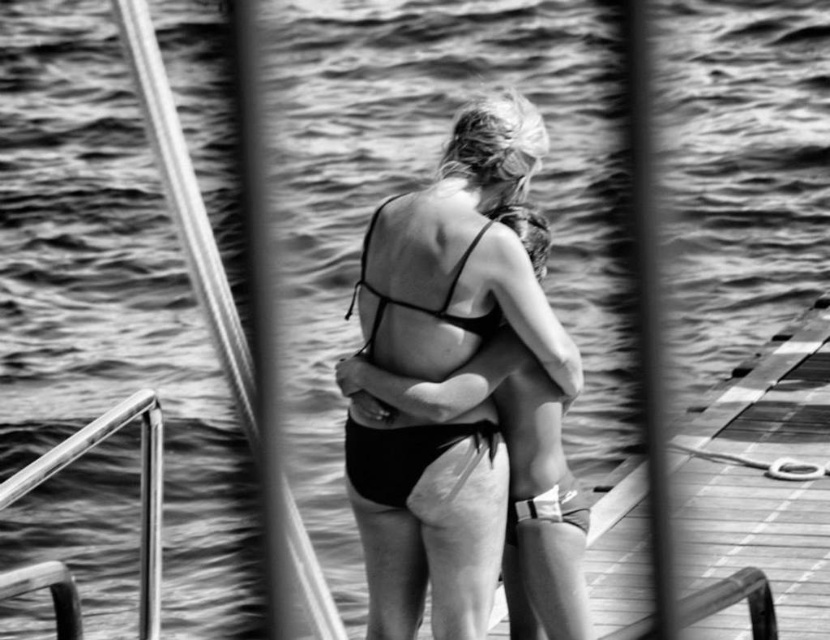
Question: Observing the image, what is the correct spatial positioning of polished metal rail at left in reference to black matte bikini top at center?

Choices:
 (A) right
 (B) left

Answer: (B)

Question: Which object is positioned farthest from the black matte swimsuit at center?

Choices:
 (A) black matte bikini at center
 (B) wooden at right

Answer: (B)

Question: Which of the following is the farthest from the observer?

Choices:
 (A) black matte bikini at center
 (B) black matte swimsuit at center

Answer: (B)

Question: Does black matte swimsuit at center appear over polished metal rail at left?

Choices:
 (A) yes
 (B) no

Answer: (B)

Question: Estimate the real-world distances between objects in this image. Which object is closer to the black matte swimsuit at center?

Choices:
 (A) wooden at right
 (B) polished metal rail at left

Answer: (B)

Question: Can you confirm if black matte bikini at center is smaller than black matte bikini top at center?

Choices:
 (A) yes
 (B) no

Answer: (A)